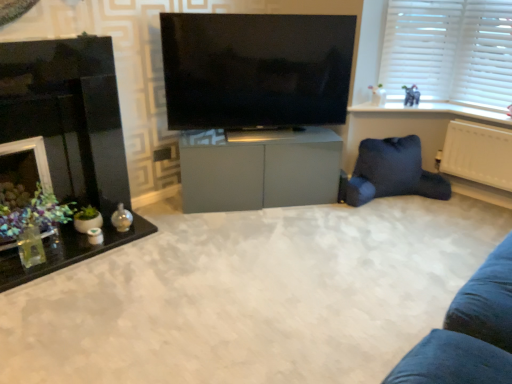
Image resolution: width=512 pixels, height=384 pixels. I want to click on vacant area located to the right-hand side of black glossy fireplace at left, so click(x=165, y=261).